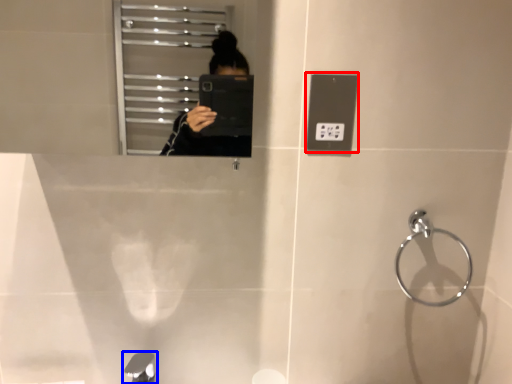
Question: Among these objects, which one is nearest to the camera, light switch (highlighted by a red box) or tap (highlighted by a blue box)?

Choices:
 (A) light switch
 (B) tap

Answer: (B)